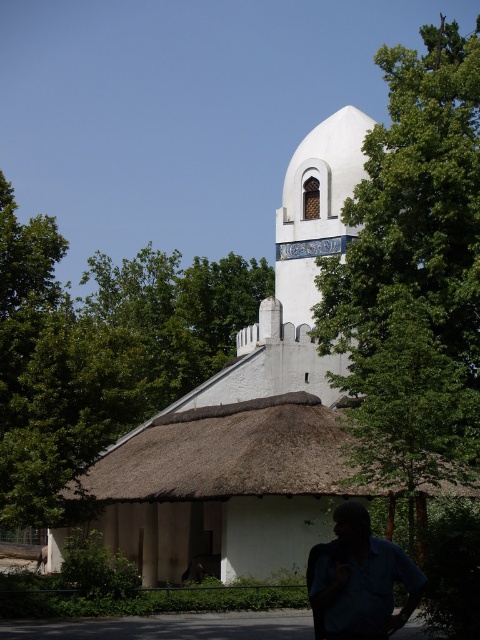
You are standing in front of the building and want to take a photo. There are two points marked on the building structure. The first point is at coordinates point (360, 307) and the second point is at point (356, 552). Which point is closer to your camera when you take the photo?

Point (356, 552) is closer to the camera because it is less further away than point (360, 307).

You are standing in front of the white stucco church at center and want to take a photo of the green leafy tree at upper center. In which direction should you turn to face the tree?

The green leafy tree at upper center is to the right of the white stucco church at center, so you should turn to your right to face the tree.